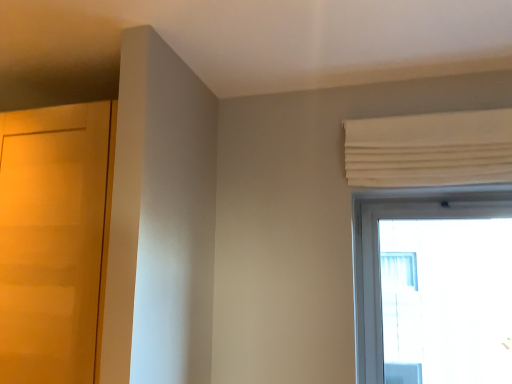
Question: Considering the positions of white pleated curtain at upper right and matte wood door at left in the image, is white pleated curtain at upper right wider or thinner than matte wood door at left?

Choices:
 (A) thin
 (B) wide

Answer: (A)

Question: Choose the correct answer: Is white pleated curtain at upper right inside matte wood door at left or outside it?

Choices:
 (A) inside
 (B) outside

Answer: (B)

Question: Is white pleated curtain at upper right in front of or behind matte wood door at left in the image?

Choices:
 (A) front
 (B) behind

Answer: (B)

Question: Is matte wood door at left to the left or to the right of white pleated curtain at upper right in the image?

Choices:
 (A) right
 (B) left

Answer: (B)

Question: Is matte wood door at left bigger or smaller than white pleated curtain at upper right?

Choices:
 (A) big
 (B) small

Answer: (A)

Question: From a real-world perspective, is matte wood door at left above or below white pleated curtain at upper right?

Choices:
 (A) above
 (B) below

Answer: (B)

Question: Is matte wood door at left inside or outside of white pleated curtain at upper right?

Choices:
 (A) inside
 (B) outside

Answer: (B)